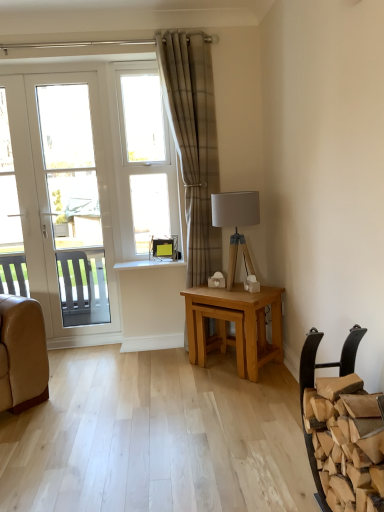
Question: Is brown leather chair at lower right beside white glossy door at left?

Choices:
 (A) yes
 (B) no

Answer: (B)

Question: From the image's perspective, is brown leather chair at lower right over white glossy door at left?

Choices:
 (A) no
 (B) yes

Answer: (A)

Question: Is brown leather chair at lower right closer to the viewer compared to white glossy door at left?

Choices:
 (A) yes
 (B) no

Answer: (A)

Question: Is brown leather chair at lower right further to camera compared to white glossy door at left?

Choices:
 (A) yes
 (B) no

Answer: (B)

Question: Considering the relative positions of brown leather chair at lower right and white glossy door at left in the image provided, is brown leather chair at lower right to the left of white glossy door at left from the viewer's perspective?

Choices:
 (A) yes
 (B) no

Answer: (B)

Question: Is point (279, 339) closer or farther from the camera than point (59, 210)?

Choices:
 (A) closer
 (B) farther

Answer: (A)

Question: From the image's perspective, is light oak wooden table at center positioned above or below white glossy door at left?

Choices:
 (A) above
 (B) below

Answer: (B)

Question: Is light oak wooden table at center taller or shorter than white glossy door at left?

Choices:
 (A) tall
 (B) short

Answer: (B)

Question: From a real-world perspective, is light oak wooden table at center above or below white glossy door at left?

Choices:
 (A) below
 (B) above

Answer: (A)

Question: Visually, is white glossy door at left positioned to the left or to the right of light oak wooden table at center?

Choices:
 (A) right
 (B) left

Answer: (B)

Question: From a real-world perspective, is white glossy door at left physically located above or below light oak wooden table at center?

Choices:
 (A) below
 (B) above

Answer: (B)

Question: In the image, is white glossy door at left positioned in front of or behind light oak wooden table at center?

Choices:
 (A) front
 (B) behind

Answer: (B)

Question: Is point (34, 129) closer or farther from the camera than point (183, 292)?

Choices:
 (A) farther
 (B) closer

Answer: (A)

Question: From the image's perspective, relative to matte gray fabric lampshade at right, is white plastic window at center above or below?

Choices:
 (A) below
 (B) above

Answer: (B)

Question: Is white plastic window at center to the left or to the right of matte gray fabric lampshade at right in the image?

Choices:
 (A) right
 (B) left

Answer: (B)